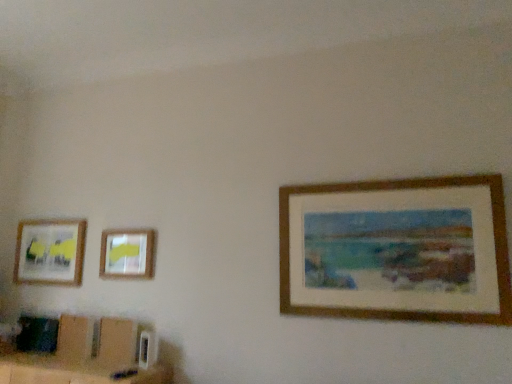
Question: Is matte plastic picture frame at upper left, placed as the second picture frame when sorted from back to front, facing away from wooden picture frame at right, the third picture frame positioned from the left?

Choices:
 (A) no
 (B) yes

Answer: (A)

Question: From a real-world perspective, is matte plastic picture frame at upper left, which is counted as the second picture frame, starting from the left, beneath wooden picture frame at right, which ranks as the 3th picture frame in back-to-front order?

Choices:
 (A) no
 (B) yes

Answer: (B)

Question: Is matte plastic picture frame at upper left, arranged as the 2th picture frame when viewed from the right, smaller than wooden picture frame at right, which ranks as the 3th picture frame in back-to-front order?

Choices:
 (A) no
 (B) yes

Answer: (B)

Question: Is wooden picture frame at right, which ranks as the 3th picture frame in back-to-front order, surrounded by matte plastic picture frame at upper left, arranged as the 2th picture frame when viewed from the right?

Choices:
 (A) no
 (B) yes

Answer: (A)

Question: Is matte plastic picture frame at upper left, positioned as the second picture frame in front-to-back order, in front of wooden picture frame at right, positioned as the first picture frame in front-to-back order?

Choices:
 (A) yes
 (B) no

Answer: (B)

Question: Is wooden picture frame at right, positioned as the first picture frame in front-to-back order, wider or thinner than matte wooden picture frame at left, the 1th picture frame when ordered from left to right?

Choices:
 (A) thin
 (B) wide

Answer: (B)

Question: Is wooden picture frame at right, the third picture frame positioned from the left, to the left or to the right of matte wooden picture frame at left, the 1th picture frame when ordered from left to right, in the image?

Choices:
 (A) right
 (B) left

Answer: (A)

Question: From their relative heights in the image, would you say wooden picture frame at right, which ranks as the 3th picture frame in back-to-front order, is taller or shorter than matte wooden picture frame at left, the 1th picture frame when ordered from left to right?

Choices:
 (A) tall
 (B) short

Answer: (A)

Question: From a real-world perspective, is wooden picture frame at right, which ranks as the 3th picture frame in back-to-front order, above or below matte wooden picture frame at left, acting as the third picture frame starting from the right?

Choices:
 (A) above
 (B) below

Answer: (A)

Question: From their relative heights in the image, would you say wooden picture frame at right, the first picture frame from the right, is taller or shorter than matte plastic picture frame at upper left, placed as the second picture frame when sorted from back to front?

Choices:
 (A) tall
 (B) short

Answer: (A)

Question: From the image's perspective, is wooden picture frame at right, positioned as the first picture frame in front-to-back order, above or below matte plastic picture frame at upper left, which is counted as the second picture frame, starting from the left?

Choices:
 (A) below
 (B) above

Answer: (B)

Question: Looking at the image, does wooden picture frame at right, which ranks as the 3th picture frame in back-to-front order, seem bigger or smaller compared to matte plastic picture frame at upper left, arranged as the 2th picture frame when viewed from the right?

Choices:
 (A) big
 (B) small

Answer: (A)

Question: Is wooden picture frame at right, which ranks as the 3th picture frame in back-to-front order, inside or outside of matte plastic picture frame at upper left, arranged as the 2th picture frame when viewed from the right?

Choices:
 (A) inside
 (B) outside

Answer: (B)

Question: Considering the relative positions of matte plastic picture frame at upper left, which is counted as the second picture frame, starting from the left, and matte wooden picture frame at left, the 1th picture frame when ordered from left to right, in the image provided, is matte plastic picture frame at upper left, which is counted as the second picture frame, starting from the left, to the left or to the right of matte wooden picture frame at left, the 1th picture frame when ordered from left to right,?

Choices:
 (A) right
 (B) left

Answer: (A)

Question: From their relative heights in the image, would you say matte plastic picture frame at upper left, arranged as the 2th picture frame when viewed from the right, is taller or shorter than matte wooden picture frame at left, which is the third picture frame from front to back?

Choices:
 (A) tall
 (B) short

Answer: (B)